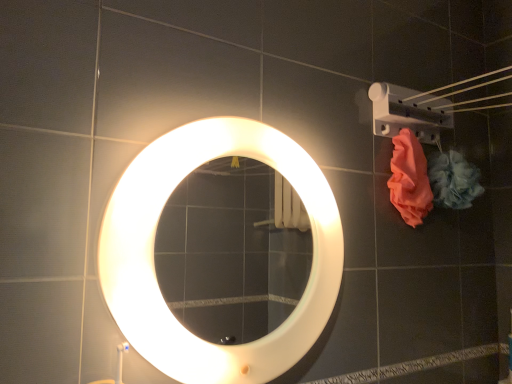
Describe the element at coordinates (154, 262) in the screenshot. I see `white glossy mirror at center` at that location.

Locate an element on the screen. white glossy mirror at center is located at coordinates coord(154,262).

What is the approximate width of white glossy mirror at center?

2.96 inches.

At what (x,y) coordinates should I click in order to perform the action: click on white glossy mirror at center. Please return your answer as a coordinate pair (x, y). The height and width of the screenshot is (384, 512). Looking at the image, I should click on (154, 262).